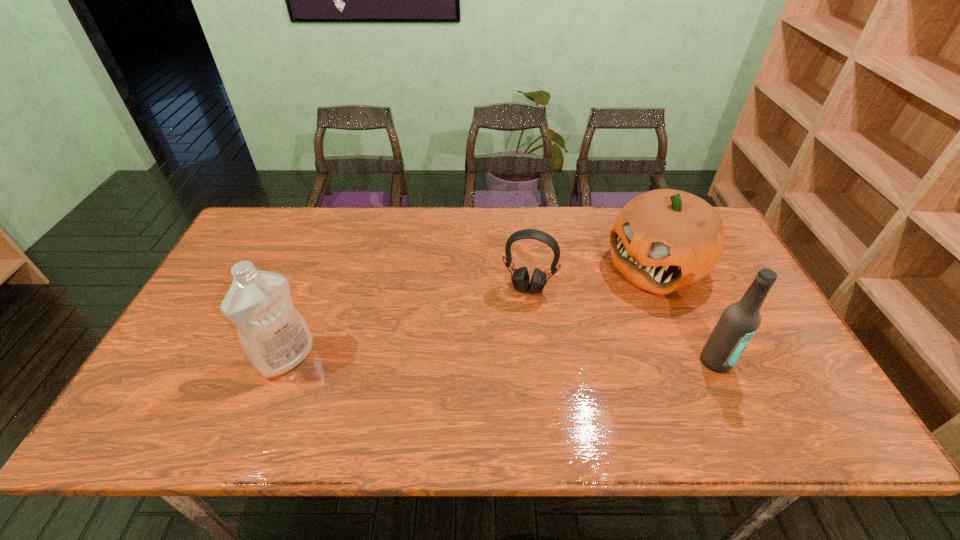
Where is `vacant space at the near edge of the desktop`? The image size is (960, 540). vacant space at the near edge of the desktop is located at coordinates (607, 397).

Where is `blank space at the left edge of the desktop`? The width and height of the screenshot is (960, 540). blank space at the left edge of the desktop is located at coordinates (213, 283).

The image size is (960, 540). In order to click on free region at the right edge in this screenshot , I will do coord(744,282).

Locate an element on the screen. The width and height of the screenshot is (960, 540). free region at the far left corner of the desktop is located at coordinates (266, 224).

Identify the location of free spot between the detergent and the headset. (407, 323).

Find the location of a particular element. This screenshot has width=960, height=540. empty location between the leftmost object and the beer bottle is located at coordinates (501, 359).

Locate an element on the screen. free space between the beer bottle and the pumpkin is located at coordinates (685, 314).

Where is `vacant area that lies between the beer bottle and the shortest object`? The height and width of the screenshot is (540, 960). vacant area that lies between the beer bottle and the shortest object is located at coordinates (622, 325).

Find the location of a particular element. unoccupied area between the third tallest object and the beer bottle is located at coordinates (685, 314).

Find the location of a particular element. vacant region between the pumpkin and the beer bottle is located at coordinates 685,314.